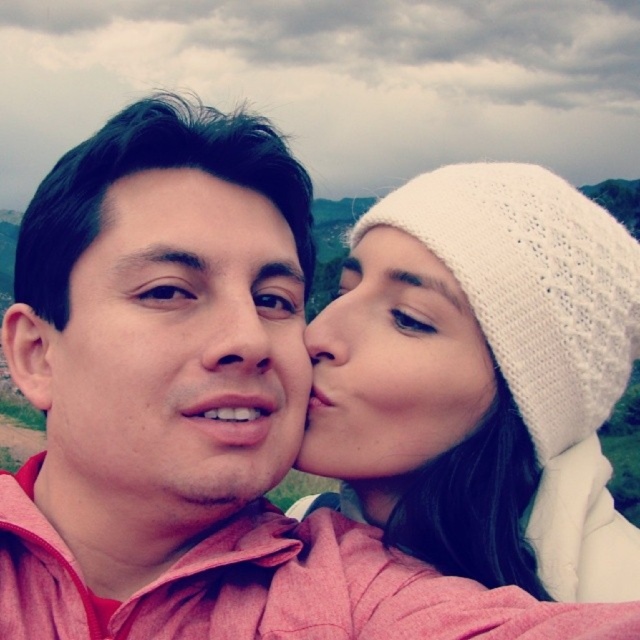
Question: Which of the following is the farthest from the observer?

Choices:
 (A) matte pink shirt at center
 (B) white knitted beanie at upper right

Answer: (A)

Question: Can you confirm if white knitted beanie at upper right is positioned above matte skin nose at center?

Choices:
 (A) no
 (B) yes

Answer: (A)

Question: Does matte skin nose at center appear on the right side of smooth skin nose at center?

Choices:
 (A) yes
 (B) no

Answer: (B)

Question: Estimate the real-world distances between objects in this image. Which object is farther from the matte pink shirt at center?

Choices:
 (A) matte black forehead at upper center
 (B) white knitted hat at upper right

Answer: (B)

Question: Is white knitted beanie at upper right smaller than smooth skin nose at center?

Choices:
 (A) yes
 (B) no

Answer: (B)

Question: Among these objects, which one is nearest to the camera?

Choices:
 (A) matte pink shirt at center
 (B) matte skin nose at center
 (C) white knitted hat at upper right
 (D) smooth skin nose at center

Answer: (A)